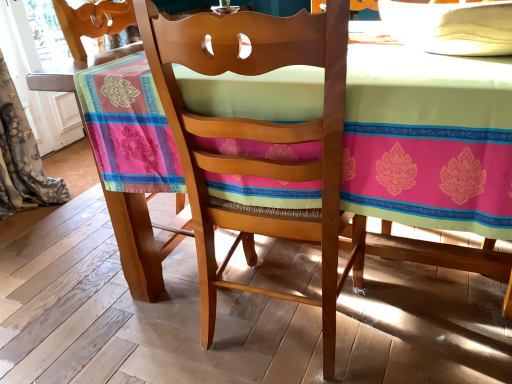
Where is `floral fabric curtain at left`? The height and width of the screenshot is (384, 512). floral fabric curtain at left is located at coordinates (21, 158).

What are the coordinates of `floral fabric curtain at left` in the screenshot? It's located at (21, 158).

Considering the positions of objects wooden table at center and wooden chair at center in the image provided, who is behind, wooden table at center or wooden chair at center?

wooden chair at center is more distant.

From the image's perspective, is wooden table at center located beneath wooden chair at center?

No, from the image's perspective, wooden table at center is not beneath wooden chair at center.

Considering the relative sizes of wooden table at center and wooden chair at center in the image provided, is wooden table at center smaller than wooden chair at center?

Incorrect, wooden table at center is not smaller in size than wooden chair at center.

Considering the relative sizes of wooden chair at center and wooden table at center in the image provided, is wooden chair at center bigger than wooden table at center?

No.

Is wooden chair at center wider or thinner than wooden table at center?

wooden chair at center is thinner than wooden table at center.

Does wooden chair at center turn towards wooden table at center?

Yes, wooden chair at center faces towards wooden table at center.

Can you confirm if wooden chair at center is taller than wooden table at center?

Yes, wooden chair at center is taller than wooden table at center.

From the image's perspective, who appears lower, wooden table at center or floral fabric curtain at left?

From the image's view, wooden table at center is below.

Is wooden table at center wider than floral fabric curtain at left?

Yes.

Is wooden table at center touching floral fabric curtain at left?

No, wooden table at center is not next to floral fabric curtain at left.

Which object is closer to the camera taking this photo, wooden table at center or floral fabric curtain at left?

wooden table at center.

Is floral fabric curtain at left turned away from wooden chair at center?

No.

Which is more to the left, floral fabric curtain at left or wooden chair at center?

Positioned to the left is floral fabric curtain at left.

Can we say wooden chair at center lies outside floral fabric curtain at left?

Yes, wooden chair at center is located beyond the bounds of floral fabric curtain at left.

Would you say wooden chair at center is a long distance from floral fabric curtain at left?

Indeed, wooden chair at center is not near floral fabric curtain at left.

Is wooden chair at center further to camera compared to floral fabric curtain at left?

No, the depth of wooden chair at center is less than that of floral fabric curtain at left.

Consider the image. Is floral fabric curtain at left to the right of wooden table at center from the viewer's perspective?

No, floral fabric curtain at left is not to the right of wooden table at center.

Relative to wooden table at center, is floral fabric curtain at left in front or behind?

In the image, floral fabric curtain at left appears behind wooden table at center.

Is floral fabric curtain at left facing away from wooden table at center?

No, floral fabric curtain at left's orientation is not away from wooden table at center.

There is a wooden table at center. Where is `chair above it (from a real-world perspective)`? chair above it (from a real-world perspective) is located at coordinates (259, 141).

Where is `chair lying behind the wooden table at center`? The image size is (512, 384). chair lying behind the wooden table at center is located at coordinates pos(259,141).

From the image, which object appears to be farther from wooden table at center, wooden chair at center or floral fabric curtain at left?

floral fabric curtain at left is positioned further to the anchor wooden table at center.

When comparing their distances from floral fabric curtain at left, does wooden table at center or wooden chair at center seem further?

wooden table at center is further to floral fabric curtain at left.

Based on their spatial positions, is wooden table at center or floral fabric curtain at left further from wooden chair at center?

Among the two, floral fabric curtain at left is located further to wooden chair at center.

Estimate the real-world distances between objects in this image. Which object is further from floral fabric curtain at left, wooden chair at center or wooden table at center?

Among the two, wooden table at center is located further to floral fabric curtain at left.

Based on their spatial positions, is floral fabric curtain at left or wooden table at center closer to wooden chair at center?

Among the two, wooden table at center is located nearer to wooden chair at center.

Estimate the real-world distances between objects in this image. Which object is closer to wooden table at center, floral fabric curtain at left or wooden chair at center?

wooden chair at center is positioned closer to the anchor wooden table at center.

I want to click on chair situated between floral fabric curtain at left and wooden table at center from left to right, so click(259, 141).